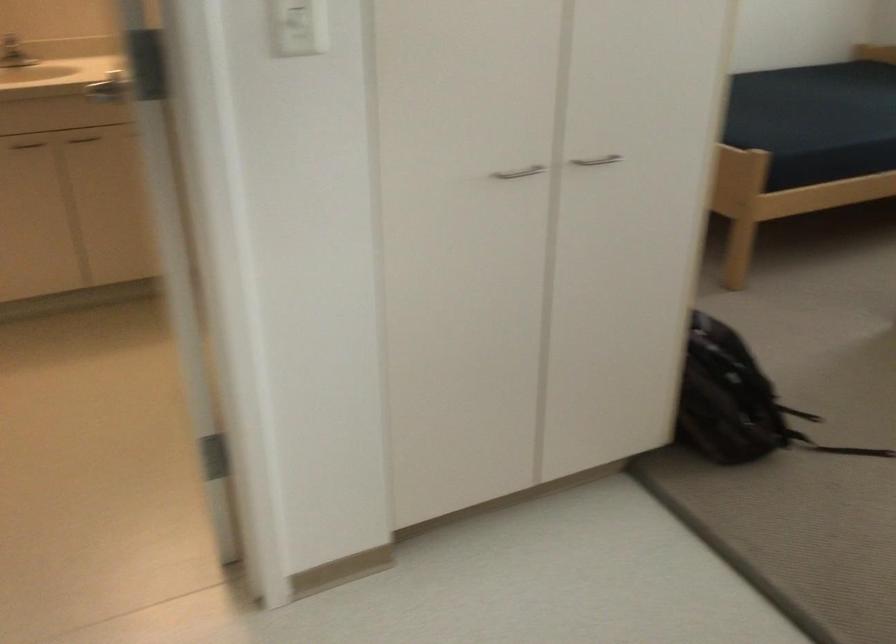
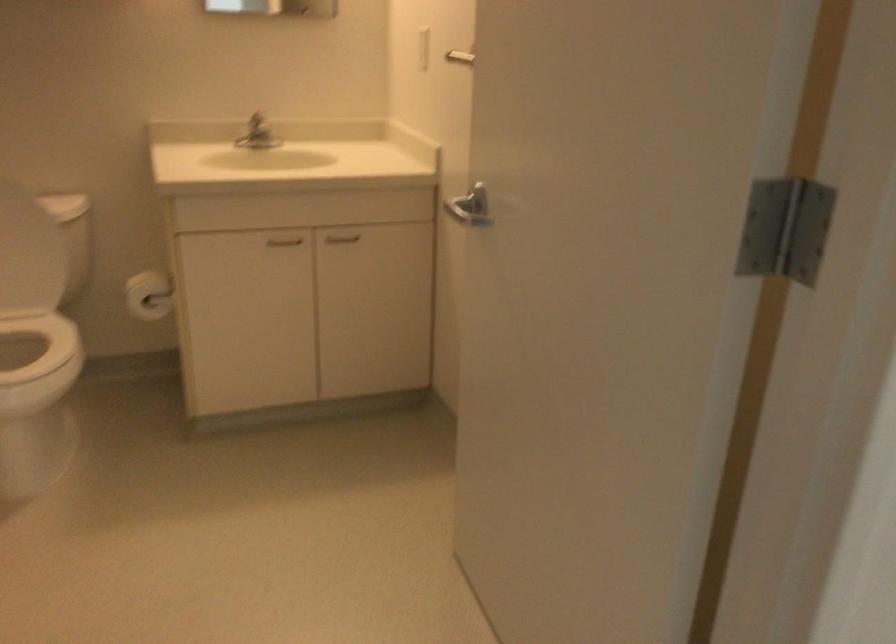
The images are taken continuously from a first-person perspective. In which direction are you moving?

The cameraman walked toward left, forward.